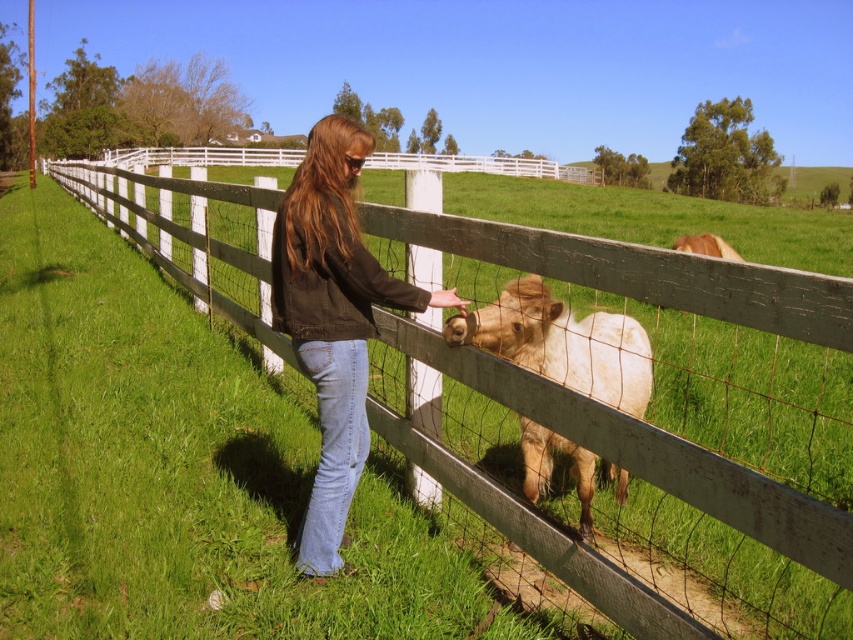
Question: Which of the following is the closest to the observer?

Choices:
 (A) (744, 451)
 (B) (341, 408)

Answer: (B)

Question: Does white wooden fence at center lie behind white woolen calf at center?

Choices:
 (A) no
 (B) yes

Answer: (A)

Question: Does white wooden fence at center have a larger size compared to white woolen calf at center?

Choices:
 (A) no
 (B) yes

Answer: (B)

Question: Can you confirm if white wooden fence at center is wider than white woolen calf at center?

Choices:
 (A) yes
 (B) no

Answer: (A)

Question: Which object is positioned farthest from the white woolen calf at center?

Choices:
 (A) denim jacket at center
 (B) white wooden fence at center

Answer: (B)

Question: Which is nearer to the white woolen calf at center?

Choices:
 (A) denim jacket at center
 (B) white wooden fence at center

Answer: (A)